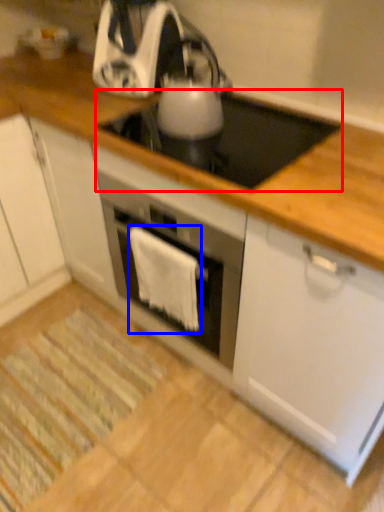
Question: Which object appears closest to the camera in this image, gas stove (highlighted by a red box) or cloth (highlighted by a blue box)?

Choices:
 (A) gas stove
 (B) cloth

Answer: (A)